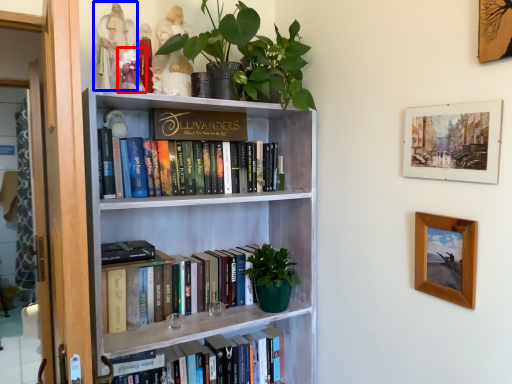
Question: Which object appears closest to the camera in this image, toy (highlighted by a red box) or toy (highlighted by a blue box)?

Choices:
 (A) toy
 (B) toy

Answer: (A)